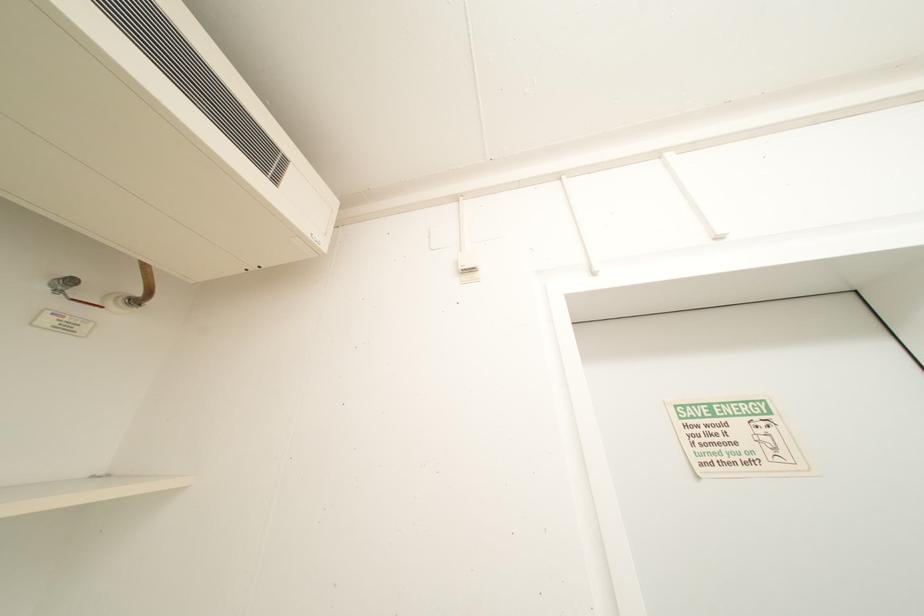
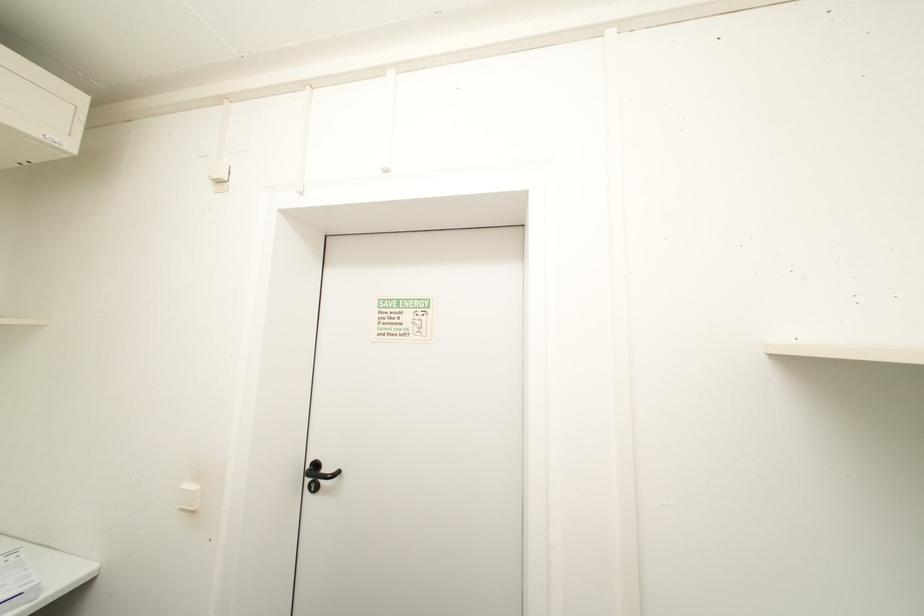
Question: In a continuous first-person perspective shot, in which direction is the camera moving?

Choices:
 (A) Left
 (B) Right
 (C) Forward
 (D) Backward

Answer: (B)